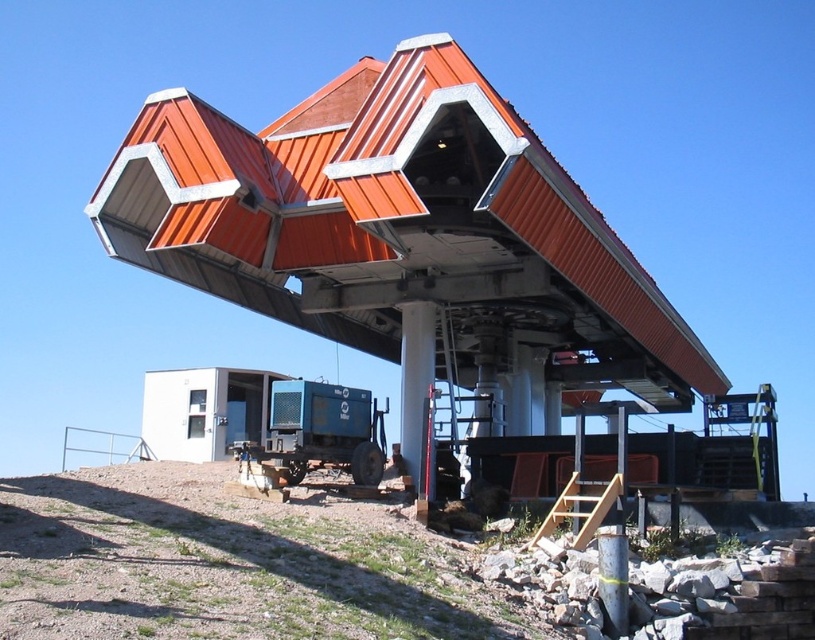
You are an architect analyzing the coordinates of the metallic orange roof at upper center in the image. What are its coordinates?

The metallic orange roof at upper center is located at coordinates point [394,220].